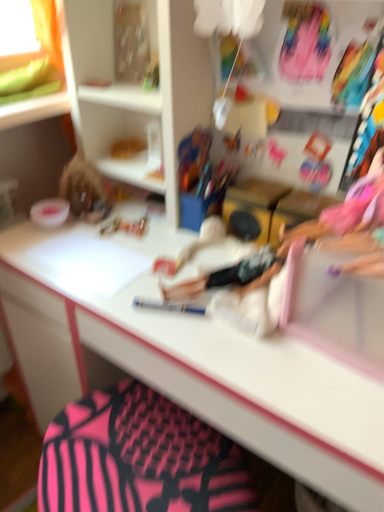
Question: Is white glossy desk at center shorter than pink fabric swivel chair at lower center?

Choices:
 (A) yes
 (B) no

Answer: (B)

Question: Considering the relative sizes of white glossy desk at center and pink fabric swivel chair at lower center in the image provided, is white glossy desk at center thinner than pink fabric swivel chair at lower center?

Choices:
 (A) yes
 (B) no

Answer: (B)

Question: Considering the relative positions of white glossy desk at center and pink fabric swivel chair at lower center in the image provided, is white glossy desk at center to the left of pink fabric swivel chair at lower center from the viewer's perspective?

Choices:
 (A) yes
 (B) no

Answer: (B)

Question: From the image's perspective, is white glossy desk at center on top of pink fabric swivel chair at lower center?

Choices:
 (A) no
 (B) yes

Answer: (B)

Question: Is white glossy desk at center behind pink fabric swivel chair at lower center?

Choices:
 (A) yes
 (B) no

Answer: (B)

Question: From a real-world perspective, is white glossy desk at center on pink fabric swivel chair at lower center?

Choices:
 (A) no
 (B) yes

Answer: (B)

Question: From the image's perspective, is pink fabric swivel chair at lower center over white glossy desk at center?

Choices:
 (A) yes
 (B) no

Answer: (B)

Question: Is the depth of pink fabric swivel chair at lower center less than that of white glossy desk at center?

Choices:
 (A) yes
 (B) no

Answer: (B)

Question: From a real-world perspective, is pink fabric swivel chair at lower center located beneath white glossy desk at center?

Choices:
 (A) no
 (B) yes

Answer: (B)

Question: Considering the relative positions of pink fabric swivel chair at lower center and white glossy desk at center in the image provided, is pink fabric swivel chair at lower center behind white glossy desk at center?

Choices:
 (A) yes
 (B) no

Answer: (A)

Question: Is pink fabric swivel chair at lower center facing towards white glossy desk at center?

Choices:
 (A) yes
 (B) no

Answer: (B)

Question: Considering the relative sizes of pink fabric swivel chair at lower center and white glossy desk at center in the image provided, is pink fabric swivel chair at lower center smaller than white glossy desk at center?

Choices:
 (A) yes
 (B) no

Answer: (A)

Question: From the image's perspective, is white glossy desk at center positioned above or below pink fabric swivel chair at lower center?

Choices:
 (A) above
 (B) below

Answer: (A)